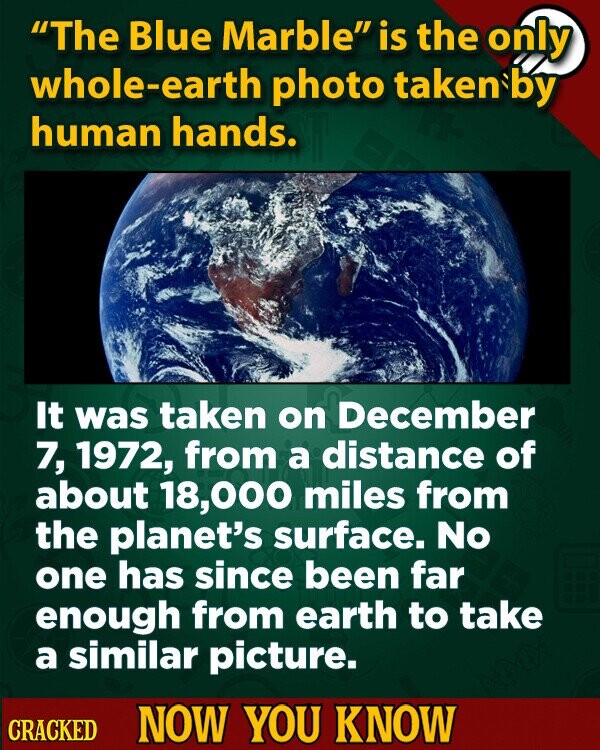
Locate an element on the screen. light bulb is located at coordinates (571, 55).